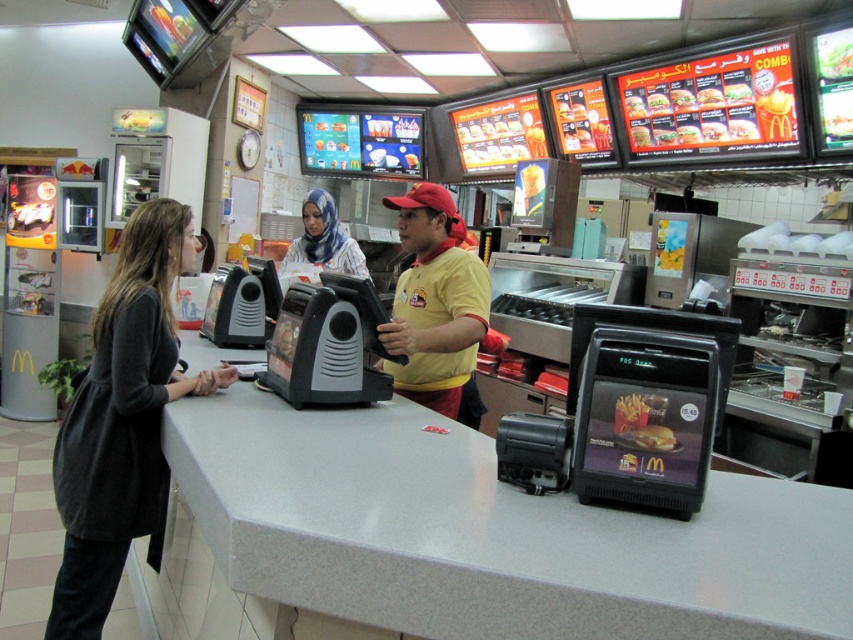
Question: Which point is farther to the camera?

Choices:
 (A) (643, 448)
 (B) (643, 528)

Answer: (A)

Question: Which object is the farthest from the golden crispy chicken at center?

Choices:
 (A) golden crispy fries at center
 (B) golden crispy french fries at center
 (C) blue printed hijab at center
 (D) yellow matte shirt at center

Answer: (B)

Question: Which point is farther to the camera?

Choices:
 (A) (701, 88)
 (B) (86, 608)
 (C) (641, 413)

Answer: (A)

Question: In this image, where is gray laminate counter at center located relative to blue printed hijab at center?

Choices:
 (A) above
 (B) below

Answer: (B)

Question: Is dark gray sweater at left bigger than yellow matte shirt at center?

Choices:
 (A) no
 (B) yes

Answer: (B)

Question: Does gray laminate counter at center appear on the right side of golden crispy fries at center?

Choices:
 (A) no
 (B) yes

Answer: (A)